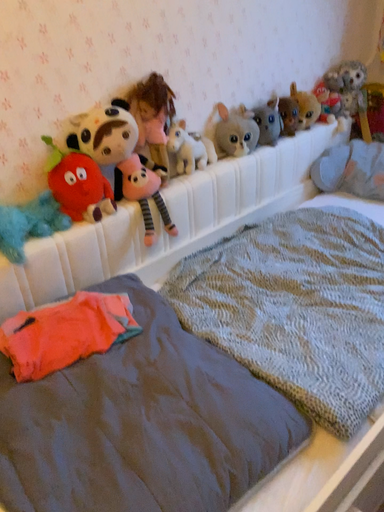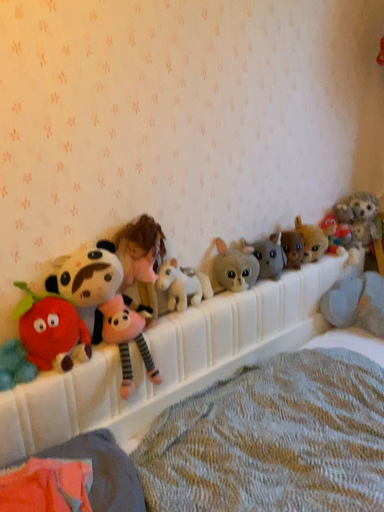
Question: Which way did the camera rotate in the video?

Choices:
 (A) rotated upward
 (B) rotated downward

Answer: (A)